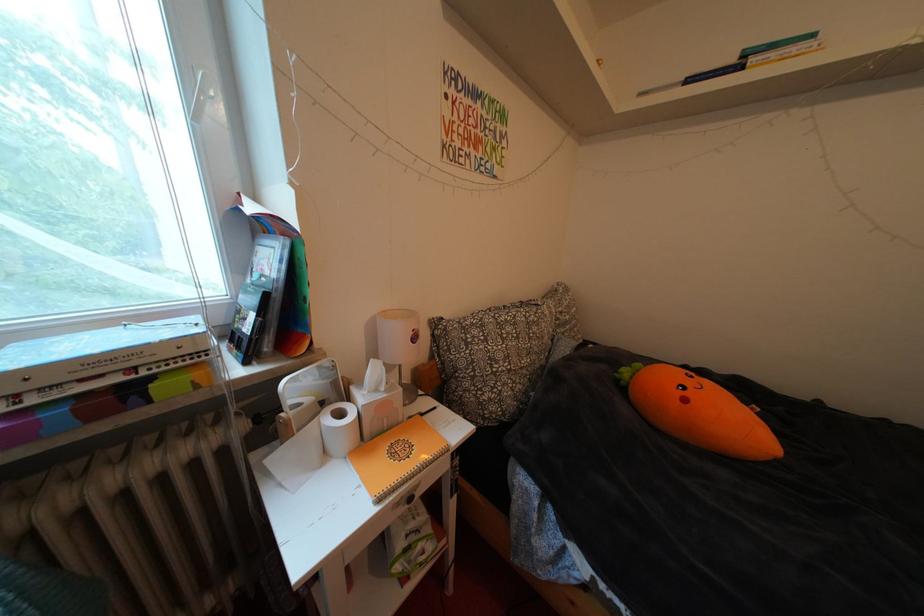
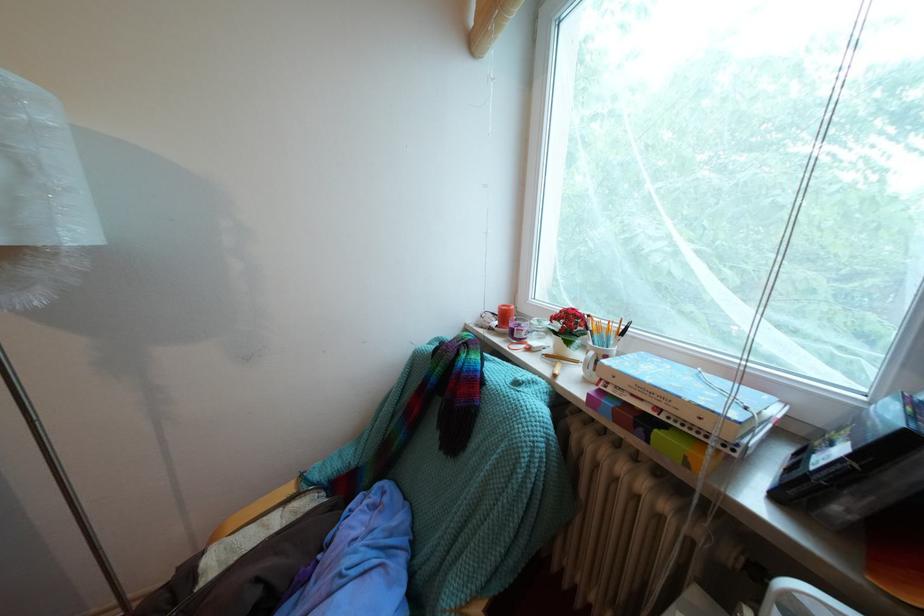
Find the pixel in the second image that matches point (144, 375) in the first image.

(669, 415)